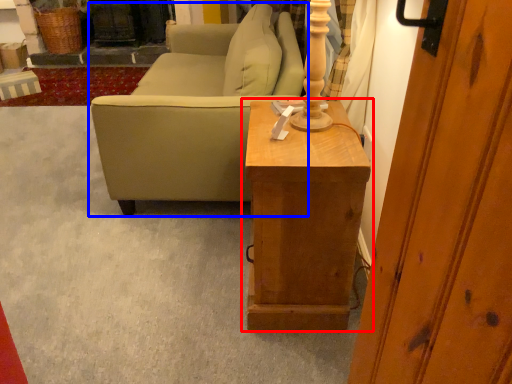
Question: Which object appears farthest to the camera in this image, table (highlighted by a red box) or studio couch (highlighted by a blue box)?

Choices:
 (A) table
 (B) studio couch

Answer: (B)